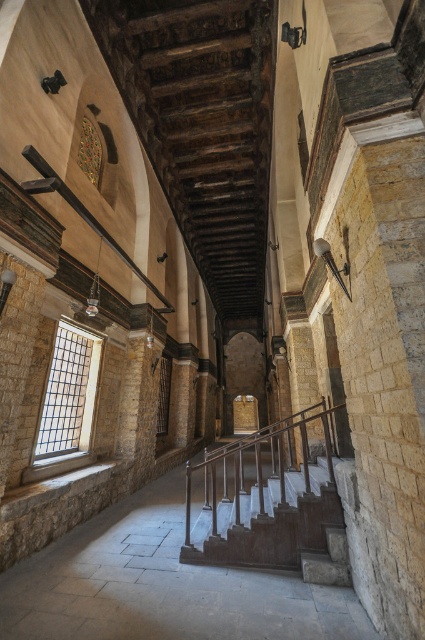
Question: Which point appears farthest from the camera in this image?

Choices:
 (A) (340, 552)
 (B) (316, 602)
 (C) (51, 394)

Answer: (C)

Question: Is smooth stone staircase at center wider than polished wood railing at center?

Choices:
 (A) no
 (B) yes

Answer: (B)

Question: Which point is farther to the camera?

Choices:
 (A) (243, 497)
 (B) (85, 392)
 (C) (235, 548)
 (D) (246, 611)

Answer: (B)

Question: Is the position of smooth stone staircase at center more distant than that of clear glass window at left?

Choices:
 (A) yes
 (B) no

Answer: (B)

Question: Observing the image, what is the correct spatial positioning of polished wood railing at center in reference to clear glass window at left?

Choices:
 (A) right
 (B) left

Answer: (A)

Question: Among these objects, which one is farthest from the camera?

Choices:
 (A) clear glass window at left
 (B) smooth stone staircase at center

Answer: (A)